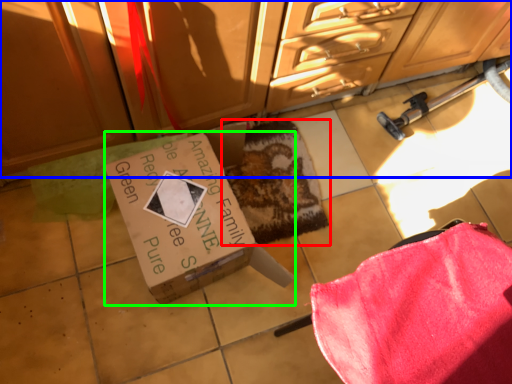
Question: Estimate the real-world distances between objects in this image. Which object is closer to mat (highlighted by a red box), cabinetry (highlighted by a blue box) or box (highlighted by a green box)?

Choices:
 (A) cabinetry
 (B) box

Answer: (B)